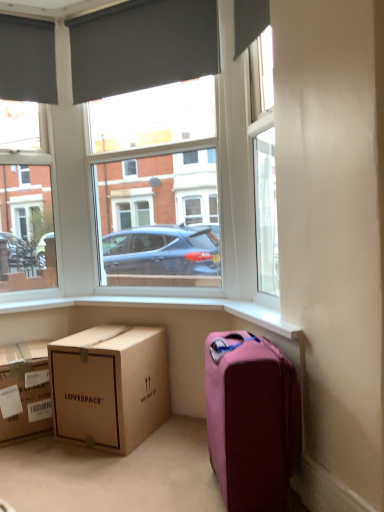
Question: Is white plastic window frame at upper center surrounded by brown cardboard box at lower left, the 1th box in the left-to-right sequence?

Choices:
 (A) no
 (B) yes

Answer: (A)

Question: Is brown cardboard box at lower left, the second box viewed from the right, thinner than white plastic window frame at upper center?

Choices:
 (A) no
 (B) yes

Answer: (A)

Question: Are brown cardboard box at lower left, the second box viewed from the right, and white plastic window frame at upper center far apart?

Choices:
 (A) yes
 (B) no

Answer: (A)

Question: From a real-world perspective, does brown cardboard box at lower left, the 1th box in the left-to-right sequence, stand above white plastic window frame at upper center?

Choices:
 (A) yes
 (B) no

Answer: (B)

Question: From the image's perspective, is brown cardboard box at lower left, the second box viewed from the right, on white plastic window frame at upper center?

Choices:
 (A) no
 (B) yes

Answer: (A)

Question: From a real-world perspective, is brown cardboard box at lower left, the 1th box in the right-to-left sequence, positioned above or below dark gray matte curtain at upper left, which is counted as the 1th curtain, starting from the left?

Choices:
 (A) above
 (B) below

Answer: (B)

Question: Choose the correct answer: Is brown cardboard box at lower left, the second box from the left, inside dark gray matte curtain at upper left, which is counted as the 1th curtain, starting from the left, or outside it?

Choices:
 (A) inside
 (B) outside

Answer: (B)

Question: From the image's perspective, is brown cardboard box at lower left, the 1th box in the right-to-left sequence, above or below dark gray matte curtain at upper left, placed as the 2th curtain when sorted from right to left?

Choices:
 (A) above
 (B) below

Answer: (B)

Question: In terms of height, does brown cardboard box at lower left, the 1th box in the right-to-left sequence, look taller or shorter compared to dark gray matte curtain at upper left, placed as the 2th curtain when sorted from right to left?

Choices:
 (A) tall
 (B) short

Answer: (B)

Question: Is dark gray fabric at upper center, positioned as the first curtain in right-to-left order, in front of or behind pink fabric suitcase at lower right in the image?

Choices:
 (A) behind
 (B) front

Answer: (A)

Question: In the image, is dark gray fabric at upper center, which ranks as the second curtain in left-to-right order, on the left side or the right side of pink fabric suitcase at lower right?

Choices:
 (A) right
 (B) left

Answer: (B)

Question: Looking at the image, does dark gray fabric at upper center, which ranks as the second curtain in left-to-right order, seem bigger or smaller compared to pink fabric suitcase at lower right?

Choices:
 (A) small
 (B) big

Answer: (A)

Question: In terms of width, does dark gray fabric at upper center, positioned as the first curtain in right-to-left order, look wider or thinner when compared to pink fabric suitcase at lower right?

Choices:
 (A) thin
 (B) wide

Answer: (A)

Question: Considering their positions, is dark gray fabric at upper center, which ranks as the second curtain in left-to-right order, located in front of or behind matte black window at upper left?

Choices:
 (A) behind
 (B) front

Answer: (B)

Question: Is dark gray fabric at upper center, positioned as the first curtain in right-to-left order, to the left or to the right of matte black window at upper left in the image?

Choices:
 (A) left
 (B) right

Answer: (B)